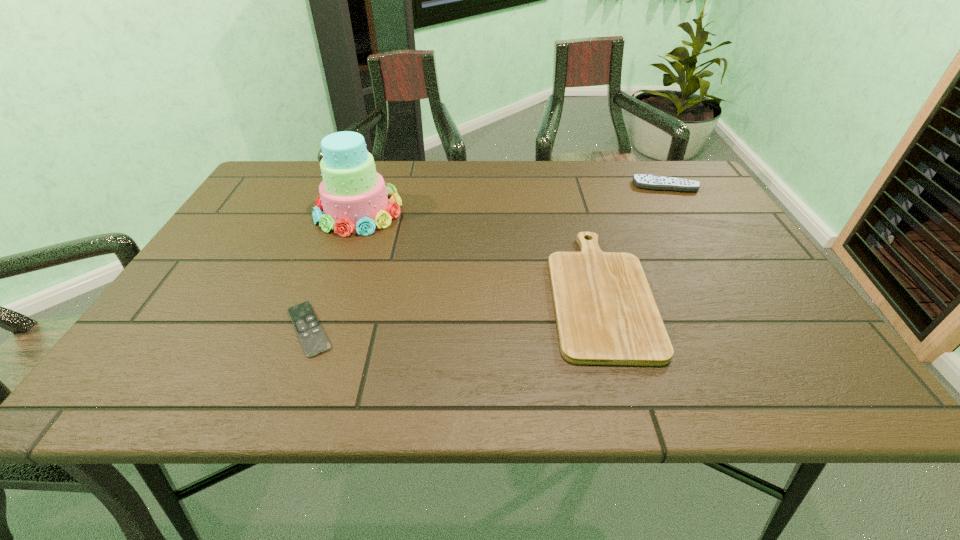
The image size is (960, 540). Find the location of `free space between the cake and the left remote control`. free space between the cake and the left remote control is located at coordinates (334, 270).

Where is `empty space between the second tallest object and the third tallest object`? empty space between the second tallest object and the third tallest object is located at coordinates (633, 239).

Find the location of a particular element. The width and height of the screenshot is (960, 540). free area in between the cake and the right remote control is located at coordinates 512,199.

Where is `object that is the third nearest to the second tallest object`? object that is the third nearest to the second tallest object is located at coordinates (314, 341).

Locate an element on the screen. the third closest object to the taller remote control is located at coordinates (314, 341).

The height and width of the screenshot is (540, 960). Find the location of `free space in the image that satisfies the following two spatial constraints: 1. on the front side of the third object from left to right; 2. on the right side of the cake`. free space in the image that satisfies the following two spatial constraints: 1. on the front side of the third object from left to right; 2. on the right side of the cake is located at coordinates (329, 292).

I want to click on free space that satisfies the following two spatial constraints: 1. on the back side of the third shortest object; 2. on the left side of the third tallest object, so click(568, 186).

Image resolution: width=960 pixels, height=540 pixels. Find the location of `vacant point that satisfies the following two spatial constraints: 1. on the back side of the cake; 2. on the right side of the right remote control`. vacant point that satisfies the following two spatial constraints: 1. on the back side of the cake; 2. on the right side of the right remote control is located at coordinates (368, 186).

Locate an element on the screen. The width and height of the screenshot is (960, 540). vacant space that satisfies the following two spatial constraints: 1. on the back side of the nearer remote control; 2. on the left side of the tallest object is located at coordinates (354, 211).